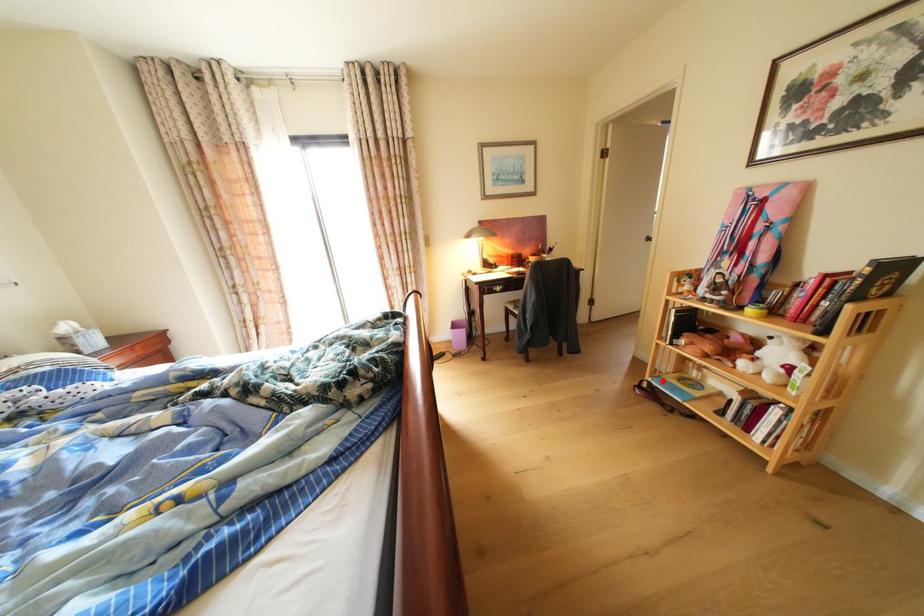
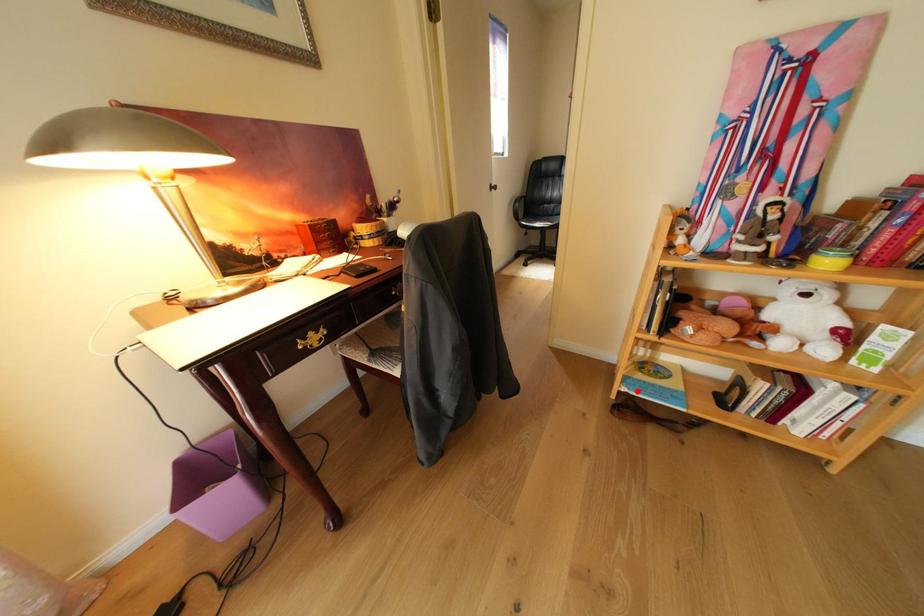
Based on the photo, I am providing you with two images of the same scene from different viewpoints. A red point is marked on the first image and another point is marked on the second image. Is the red point in image1 aligned with the point shown in image2?

Yes